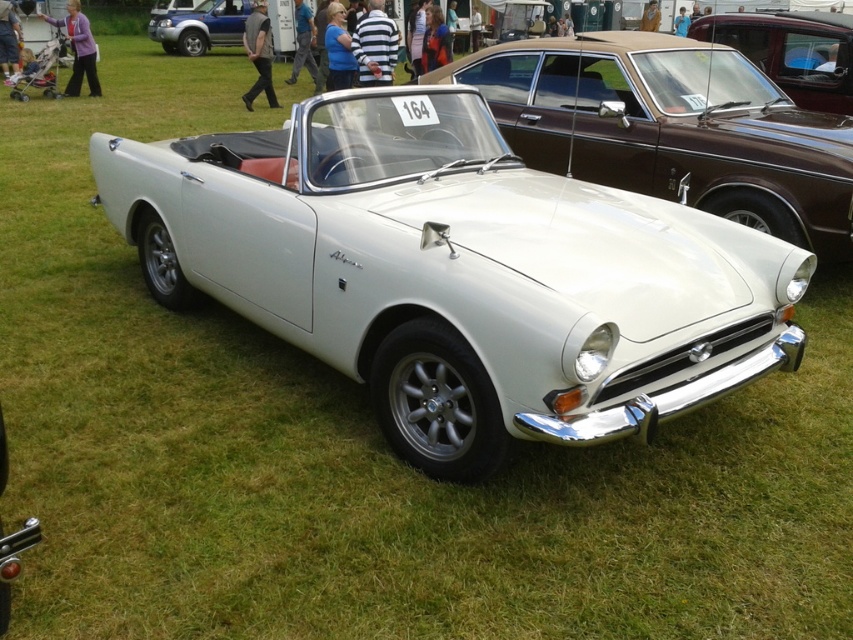
Question: Observing the image, what is the correct spatial positioning of white glossy convertible at center in reference to shiny brown car at upper right?

Choices:
 (A) left
 (B) right

Answer: (A)

Question: Does white glossy convertible at center have a larger size compared to matte blue suv at upper left?

Choices:
 (A) yes
 (B) no

Answer: (A)

Question: Which of the following is the farthest from the observer?

Choices:
 (A) (166, 19)
 (B) (837, 84)
 (C) (816, 241)

Answer: (A)

Question: Observing the image, what is the correct spatial positioning of white glossy convertible at center in reference to matte blue suv at upper left?

Choices:
 (A) above
 (B) below

Answer: (B)

Question: Which of the following is the farthest from the observer?

Choices:
 (A) (776, 51)
 (B) (196, 17)
 (C) (454, 83)

Answer: (B)

Question: Which of the following is the farthest from the observer?

Choices:
 (A) (648, 51)
 (B) (227, 1)
 (C) (761, 24)

Answer: (B)